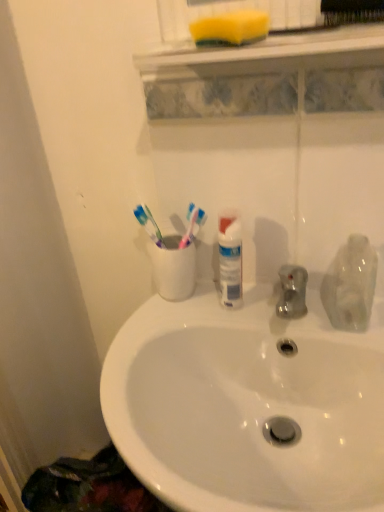
Question: Does white glossy sink at center have a smaller size compared to transparent plastic bottle at right?

Choices:
 (A) no
 (B) yes

Answer: (A)

Question: From the image's perspective, would you say white glossy sink at center is shown under transparent plastic bottle at right?

Choices:
 (A) no
 (B) yes

Answer: (B)

Question: Is white glossy sink at center far away from transparent plastic bottle at right?

Choices:
 (A) no
 (B) yes

Answer: (A)

Question: Does white glossy sink at center have a lesser width compared to transparent plastic bottle at right?

Choices:
 (A) no
 (B) yes

Answer: (A)

Question: From the image's perspective, is white glossy sink at center on top of transparent plastic bottle at right?

Choices:
 (A) no
 (B) yes

Answer: (A)

Question: Is white glossy sink at center beside transparent plastic bottle at right?

Choices:
 (A) yes
 (B) no

Answer: (B)

Question: From the image's perspective, is yellow sponge at upper center on top of black bristle brush at upper center?

Choices:
 (A) yes
 (B) no

Answer: (B)

Question: Is yellow sponge at upper center bigger than black bristle brush at upper center?

Choices:
 (A) yes
 (B) no

Answer: (B)

Question: Is yellow sponge at upper center at the right side of black bristle brush at upper center?

Choices:
 (A) yes
 (B) no

Answer: (B)

Question: Can you confirm if yellow sponge at upper center is taller than black bristle brush at upper center?

Choices:
 (A) yes
 (B) no

Answer: (B)

Question: From the image's perspective, is yellow sponge at upper center beneath black bristle brush at upper center?

Choices:
 (A) no
 (B) yes

Answer: (B)

Question: Is yellow sponge at upper center oriented towards black bristle brush at upper center?

Choices:
 (A) no
 (B) yes

Answer: (A)

Question: Are black bristle brush at upper center and yellow sponge at upper center beside each other?

Choices:
 (A) no
 (B) yes

Answer: (B)